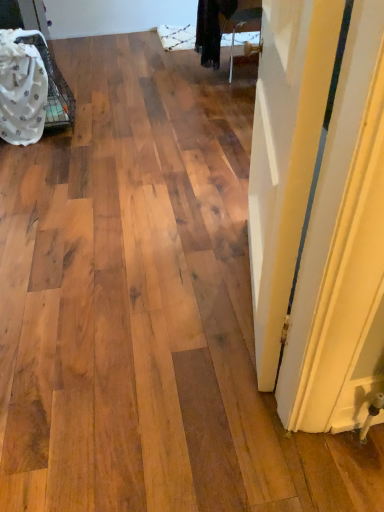
Question: Is the depth of white painted wood door at right greater than that of white fabric at left?

Choices:
 (A) no
 (B) yes

Answer: (A)

Question: Can you confirm if white painted wood door at right is thinner than white fabric at left?

Choices:
 (A) yes
 (B) no

Answer: (B)

Question: Can you confirm if white painted wood door at right is positioned to the right of white fabric at left?

Choices:
 (A) no
 (B) yes

Answer: (B)

Question: From a real-world perspective, is white painted wood door at right physically below white fabric at left?

Choices:
 (A) no
 (B) yes

Answer: (A)

Question: Can you confirm if white painted wood door at right is shorter than white fabric at left?

Choices:
 (A) yes
 (B) no

Answer: (B)

Question: Can you confirm if white painted wood door at right is smaller than white fabric at left?

Choices:
 (A) yes
 (B) no

Answer: (A)

Question: Could white painted wood door at right be considered to be inside white fabric at left?

Choices:
 (A) yes
 (B) no

Answer: (B)

Question: Could you tell me if white fabric at left is turned towards white painted wood door at right?

Choices:
 (A) yes
 (B) no

Answer: (B)

Question: Is white fabric at left to the left of white painted wood door at right from the viewer's perspective?

Choices:
 (A) no
 (B) yes

Answer: (B)

Question: Is white fabric at left wider than white painted wood door at right?

Choices:
 (A) yes
 (B) no

Answer: (B)

Question: Considering the relative sizes of white fabric at left and white painted wood door at right in the image provided, is white fabric at left shorter than white painted wood door at right?

Choices:
 (A) no
 (B) yes

Answer: (B)

Question: Is white fabric at left outside of white painted wood door at right?

Choices:
 (A) no
 (B) yes

Answer: (B)

Question: Is white fabric at left inside the boundaries of white painted wood door at right, or outside?

Choices:
 (A) outside
 (B) inside

Answer: (A)